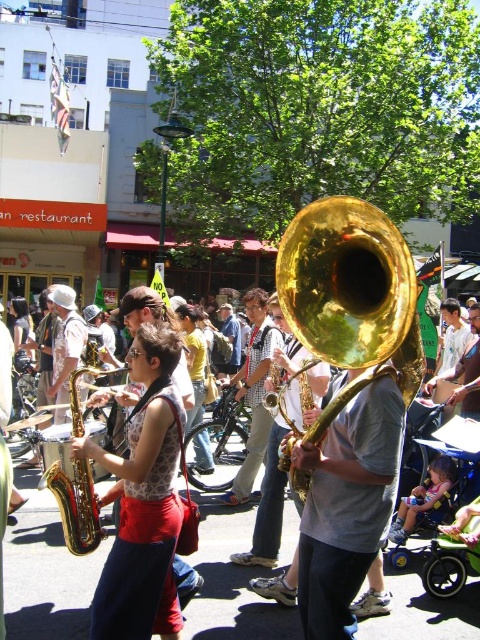
Consider the image. You are a street performer who wants to carry both the matte gold saxophone at center and the gold shiny tuba at center to your next gig. Which instrument should you choose if you want the one that is easier to carry through narrow alleys?

The matte gold saxophone at center is thinner than the gold shiny tuba at center, so it would be easier to carry through narrow alleys.

You are standing at the center of the street scene. There is a point marked at coordinates (143, 500). What object is located at that point?

The point at coordinates (143, 500) indicates the location of the matte gold saxophone at center.